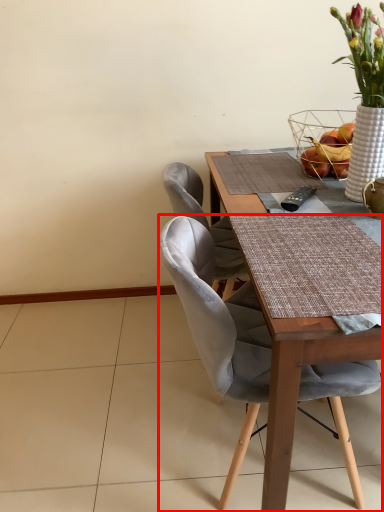
Question: Where is chair (annotated by the red box) located in relation to basket in the image?

Choices:
 (A) right
 (B) left

Answer: (B)